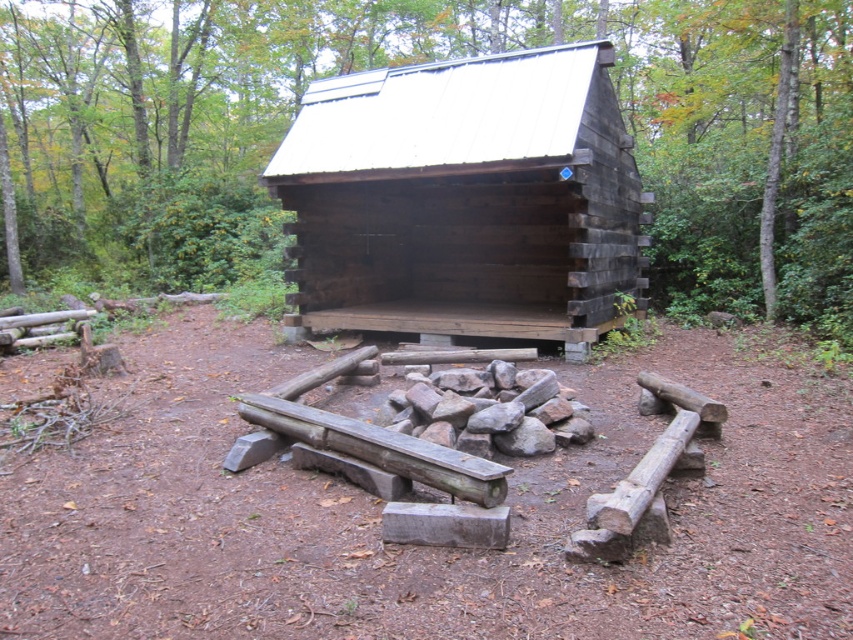
You are planning to set up a tent in this outdoor area. Considering the brown wooden shelter at center and the green leafy tree at upper right, which object is positioned higher in the image?

The brown wooden shelter at center is above the green leafy tree at upper right, so it is positioned higher in the image.

You are planning to set up a tent in this outdoor area. Considering the dark brown wood log cabin at center and the green leafy tree at upper right, which object is positioned higher up in the scene?

The green leafy tree at upper right is positioned higher up in the scene than the dark brown wood log cabin at center.

You are standing at the origin point of the coordinate system. Where is the brown wooden shelter at center located in terms of coordinates?

The brown wooden shelter at center is located at point coordinates of (451, 152).